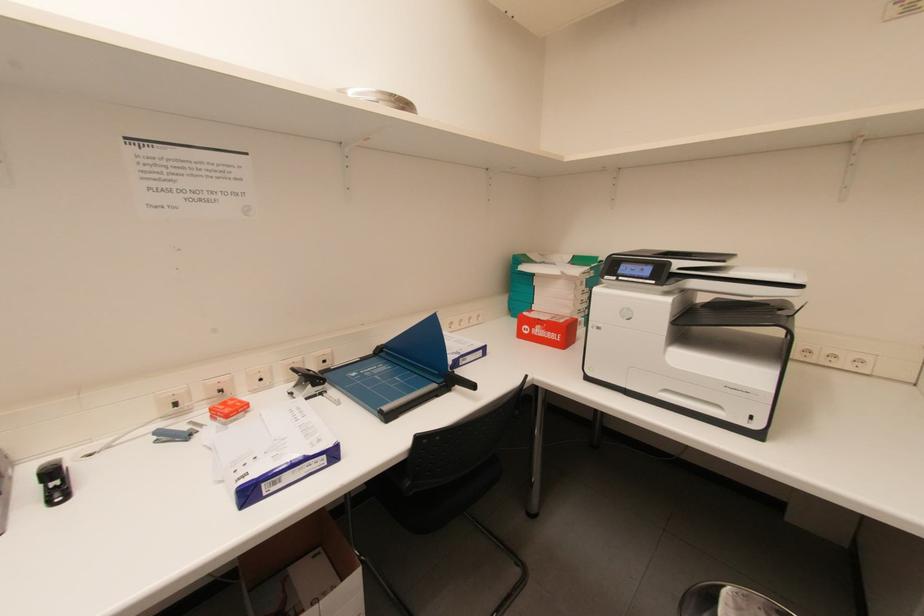
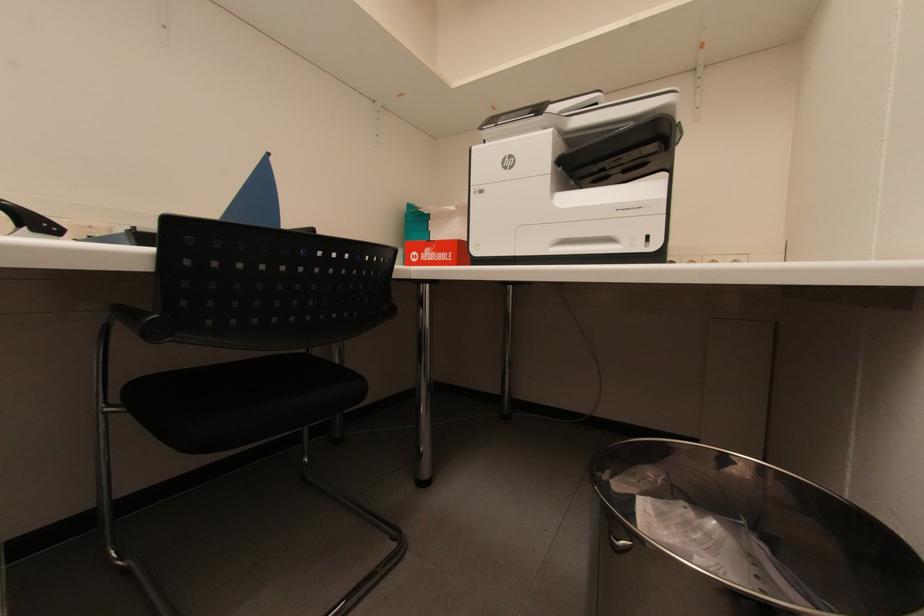
Question: The first image is from the beginning of the video and the second image is from the end. How did the camera likely rotate when shooting the video?

Choices:
 (A) Left
 (B) Right
 (C) Up
 (D) Down

Answer: (B)